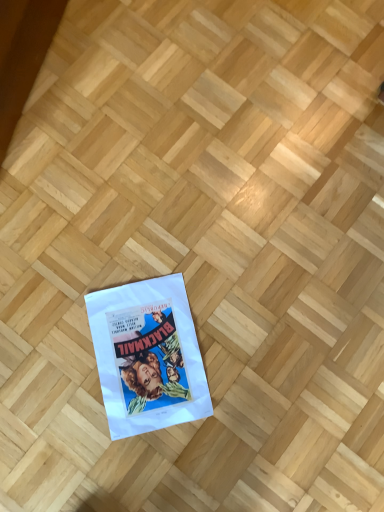
The height and width of the screenshot is (512, 384). I want to click on free region under white paper at center (from a real-world perspective), so click(152, 350).